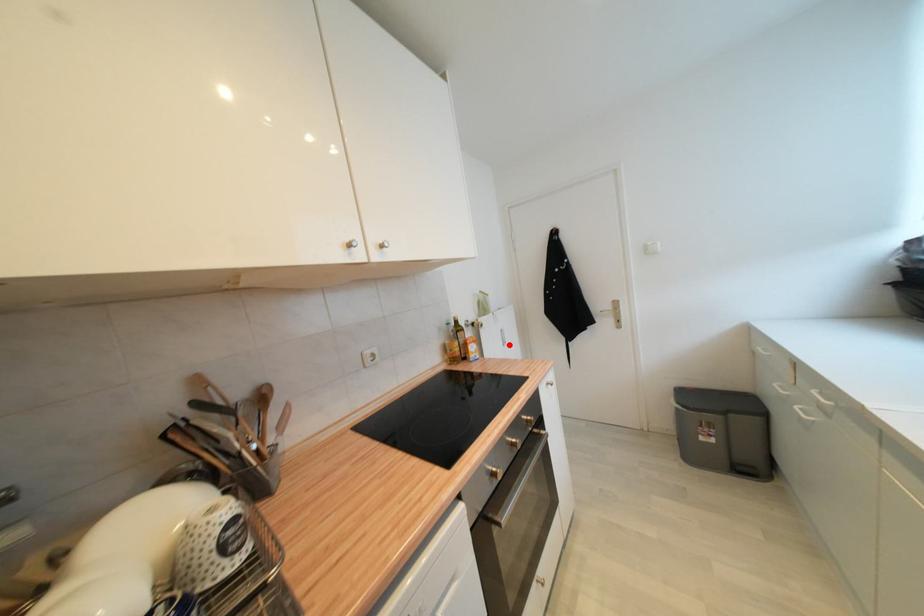
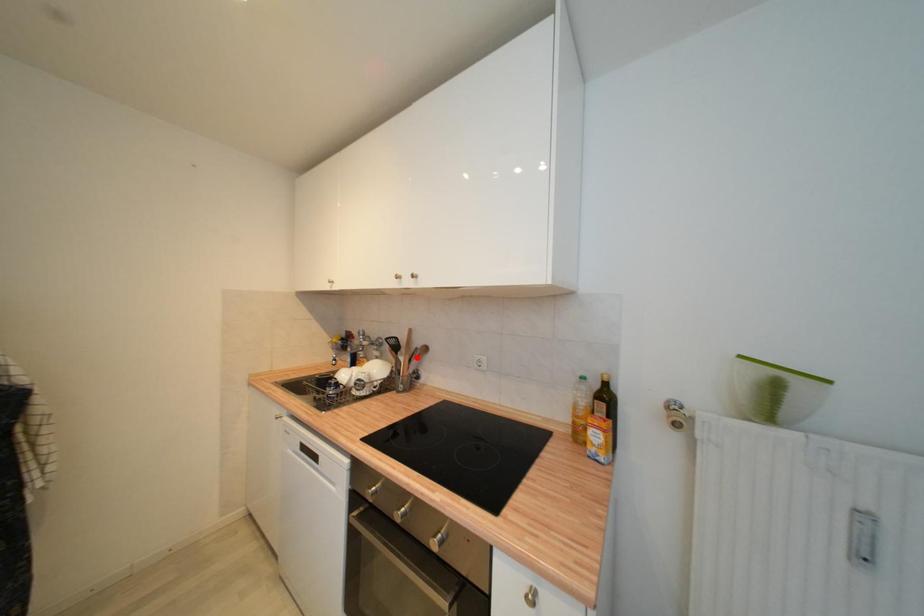
I am providing you with two images of the same scene from different viewpoints. A red point is marked on the first image and another point is marked on the second image. Are the points marked in image1 and image2 representing the same 3D position?

No